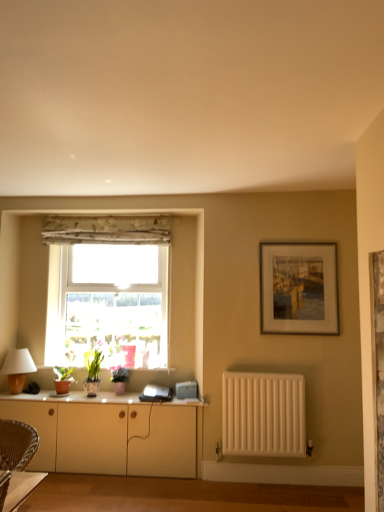
Question: Is wooden framed painting at upper right facing towards floral fabric curtain at upper center?

Choices:
 (A) no
 (B) yes

Answer: (A)

Question: Is wooden framed painting at upper right wider than floral fabric curtain at upper center?

Choices:
 (A) yes
 (B) no

Answer: (B)

Question: Is wooden framed painting at upper right oriented away from floral fabric curtain at upper center?

Choices:
 (A) no
 (B) yes

Answer: (A)

Question: From the image's perspective, would you say wooden framed painting at upper right is positioned over floral fabric curtain at upper center?

Choices:
 (A) no
 (B) yes

Answer: (A)

Question: From a real-world perspective, does wooden framed painting at upper right sit lower than floral fabric curtain at upper center?

Choices:
 (A) no
 (B) yes

Answer: (B)

Question: Is the depth of wooden framed painting at upper right greater than that of floral fabric curtain at upper center?

Choices:
 (A) no
 (B) yes

Answer: (A)

Question: Can you confirm if matte brown table lamp at left is bigger than floral fabric curtain at upper center?

Choices:
 (A) no
 (B) yes

Answer: (B)

Question: Can you confirm if matte brown table lamp at left is positioned to the right of floral fabric curtain at upper center?

Choices:
 (A) yes
 (B) no

Answer: (B)

Question: Considering the relative sizes of matte brown table lamp at left and floral fabric curtain at upper center in the image provided, is matte brown table lamp at left taller than floral fabric curtain at upper center?

Choices:
 (A) no
 (B) yes

Answer: (B)

Question: Is matte brown table lamp at left in front of floral fabric curtain at upper center?

Choices:
 (A) yes
 (B) no

Answer: (A)

Question: Considering the relative positions of matte brown table lamp at left and floral fabric curtain at upper center in the image provided, is matte brown table lamp at left to the left of floral fabric curtain at upper center from the viewer's perspective?

Choices:
 (A) no
 (B) yes

Answer: (B)

Question: From a real-world perspective, is matte brown table lamp at left beneath floral fabric curtain at upper center?

Choices:
 (A) yes
 (B) no

Answer: (A)

Question: Is white matte radiator at lower right behind floral fabric curtain at upper center?

Choices:
 (A) no
 (B) yes

Answer: (A)